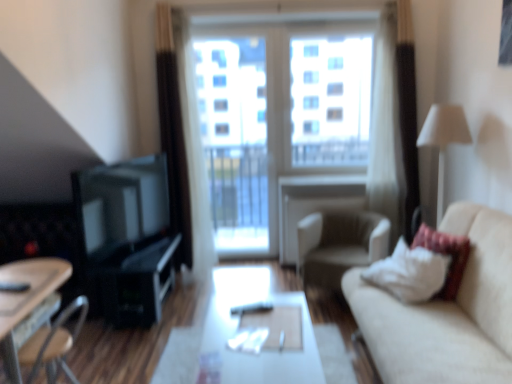
Find the location of a particular element. beige fabric couch at right is located at coordinates (446, 312).

At what (x,y) coordinates should I click in order to perform the action: click on white soft pillow at right. Please return your answer as a coordinate pair (x, y). The image size is (512, 384). Looking at the image, I should click on (445, 254).

What do you see at coordinates (126, 238) in the screenshot? The width and height of the screenshot is (512, 384). I see `matte black entertainment center at left` at bounding box center [126, 238].

This screenshot has width=512, height=384. I want to click on white sheer curtain at left, so click(173, 134).

The height and width of the screenshot is (384, 512). I want to click on wooden table at lower left, arranged as the first table when viewed from the left, so pyautogui.click(x=28, y=305).

The image size is (512, 384). What do you see at coordinates (28, 305) in the screenshot?
I see `wooden table at lower left, the second table when ordered from right to left` at bounding box center [28, 305].

Where is `transparent glass window at center`? The width and height of the screenshot is (512, 384). transparent glass window at center is located at coordinates (330, 100).

Considering the relative sizes of white sheer curtain at left and wooden table at lower left, the second table when ordered from right to left, in the image provided, is white sheer curtain at left taller than wooden table at lower left, the second table when ordered from right to left,?

Yes, white sheer curtain at left is taller than wooden table at lower left, the second table when ordered from right to left.

How distant is white sheer curtain at left from wooden table at lower left, the second table when ordered from right to left?

1.86 meters.

Considering the points (156, 51) and (23, 335), which point is in front, point (156, 51) or point (23, 335)?

The point (23, 335) is closer.

From a real-world perspective, is matte black entertainment center at left located higher than transparent glass window at center?

No, from a real-world perspective, matte black entertainment center at left is not over transparent glass window at center

Considering the positions of objects matte black entertainment center at left and transparent glass window at center in the image provided, who is more to the left, matte black entertainment center at left or transparent glass window at center?

From the viewer's perspective, matte black entertainment center at left appears more on the left side.

Choose the correct answer: Is matte black entertainment center at left inside transparent glass window at center or outside it?

matte black entertainment center at left is spatially situated outside transparent glass window at center.

Which of these two, white soft pillow at right or white glossy table at center, the first table from the right, is bigger?

white glossy table at center, the first table from the right, is bigger.

What's the angular difference between white soft pillow at right and white glossy table at center, the first table from the right,'s facing directions?

The angular difference between white soft pillow at right and white glossy table at center, the first table from the right, is 91.3 degrees.

Is white soft pillow at right inside the boundaries of white glossy table at center, marked as the second table in a left-to-right arrangement, or outside?

white soft pillow at right cannot be found inside white glossy table at center, marked as the second table in a left-to-right arrangement.

Considering the positions of objects white soft pillow at right and white glossy table at center, marked as the second table in a left-to-right arrangement, in the image provided, who is more to the left, white soft pillow at right or white glossy table at center, marked as the second table in a left-to-right arrangement,?

white glossy table at center, marked as the second table in a left-to-right arrangement, is more to the left.

From the image's perspective, which object appears higher, transparent glass window at center or white glossy table at center, the first table from the right?

transparent glass window at center appears higher in the image.

Which object is further away from the camera taking this photo, transparent glass window at center or white glossy table at center, the first table from the right?

transparent glass window at center is further away from the camera.

How many degrees apart are the facing directions of transparent glass window at center and white glossy table at center, the first table from the right?

There is a 1.1-degree angle between the facing directions of transparent glass window at center and white glossy table at center, the first table from the right.

Is transparent glass window at center beside white glossy table at center, the first table from the right?

transparent glass window at center and white glossy table at center, the first table from the right, are not in contact.

Which object is positioned more to the left, beige fabric couch at right or white glossy table at center, the first table from the right?

white glossy table at center, the first table from the right, is more to the left.

Consider the image. Which of these two, beige fabric couch at right or white glossy table at center, marked as the second table in a left-to-right arrangement, is smaller?

white glossy table at center, marked as the second table in a left-to-right arrangement, is smaller.

Between beige fabric couch at right and white glossy table at center, marked as the second table in a left-to-right arrangement, which one has less height?

Standing shorter between the two is white glossy table at center, marked as the second table in a left-to-right arrangement.

Which object is further away from the camera taking this photo, white sheer curtain at left or transparent glass screen door at center?

Positioned behind is transparent glass screen door at center.

From a real-world perspective, which object rests below the other?

transparent glass screen door at center.

Is white sheer curtain at left far from transparent glass screen door at center?

white sheer curtain at left is near transparent glass screen door at center, not far away.

Is white sheer curtain at left wider than transparent glass screen door at center?

Correct, the width of white sheer curtain at left exceeds that of transparent glass screen door at center.

Considering the sizes of objects wooden table at lower left, arranged as the first table when viewed from the left, and transparent glass screen door at center in the image provided, who is bigger, wooden table at lower left, arranged as the first table when viewed from the left, or transparent glass screen door at center?

With larger size is wooden table at lower left, arranged as the first table when viewed from the left.

Can you see wooden table at lower left, arranged as the first table when viewed from the left, touching transparent glass screen door at center?

There is a gap between wooden table at lower left, arranged as the first table when viewed from the left, and transparent glass screen door at center.

Does wooden table at lower left, arranged as the first table when viewed from the left, have a greater width compared to transparent glass screen door at center?

Indeed, wooden table at lower left, arranged as the first table when viewed from the left, has a greater width compared to transparent glass screen door at center.

Which is farther, (45, 318) or (213, 128)?

The point (213, 128) is farther.

You are a GUI agent. You are given a task and a screenshot of the screen. Output one action in this format:
    pyautogui.click(x=<x>, y=<y>)
    Task: Click on the curtain above the wooden table at lower left, the second table when ordered from right to left (from the image's perspective)
    
    Given the screenshot: What is the action you would take?
    pyautogui.click(x=173, y=134)

The height and width of the screenshot is (384, 512). I want to click on window screen behind the matte black entertainment center at left, so tap(330, 100).

When comparing their distances from transparent glass screen door at center, does beige fabric armchair at center or matte black entertainment center at left seem closer?

The object closer to transparent glass screen door at center is beige fabric armchair at center.

Looking at the image, which one is located closer to transparent glass window at center, white glossy table at center, marked as the second table in a left-to-right arrangement, or transparent glass screen door at center?

transparent glass screen door at center.

In the scene shown: From the image, which object appears to be farther from white soft pillow at right, beige fabric armchair at center or white fabric lampshade at right?

white fabric lampshade at right is positioned further to the anchor white soft pillow at right.

Which object lies nearer to the anchor point beige fabric armchair at center, transparent glass window at center or wooden table at lower left, the second table when ordered from right to left?

transparent glass window at center.

Looking at this image, which object lies nearer to the anchor point white fabric lampshade at right, white sheer curtain at left or matte black entertainment center at left?

The object closer to white fabric lampshade at right is white sheer curtain at left.

Looking at the image, which one is located closer to transparent glass screen door at center, wooden table at lower left, arranged as the first table when viewed from the left, or matte black entertainment center at left?

matte black entertainment center at left is closer to transparent glass screen door at center.

From the image, which object appears to be farther from transparent glass window at center, wooden table at lower left, the second table when ordered from right to left, or beige fabric couch at right?

Among the two, wooden table at lower left, the second table when ordered from right to left, is located further to transparent glass window at center.

Which object lies further to the anchor point white sheer curtain at left, white fabric lampshade at right or wooden table at lower left, the second table when ordered from right to left?

white fabric lampshade at right.

Find the location of a particular element. Image resolution: width=512 pixels, height=384 pixels. pillow between white glossy table at center, the first table from the right, and transparent glass screen door at center, along the z-axis is located at coordinates (445, 254).

This screenshot has width=512, height=384. I want to click on screen door situated between matte black entertainment center at left and white fabric lampshade at right from left to right, so click(x=234, y=142).

Find the location of a particular element. The width and height of the screenshot is (512, 384). pillow between white glossy table at center, the first table from the right, and beige fabric armchair at center from front to back is located at coordinates (445, 254).

Locate an element on the screen. curtain located between matte black entertainment center at left and transparent glass screen door at center in the depth direction is located at coordinates (173, 134).